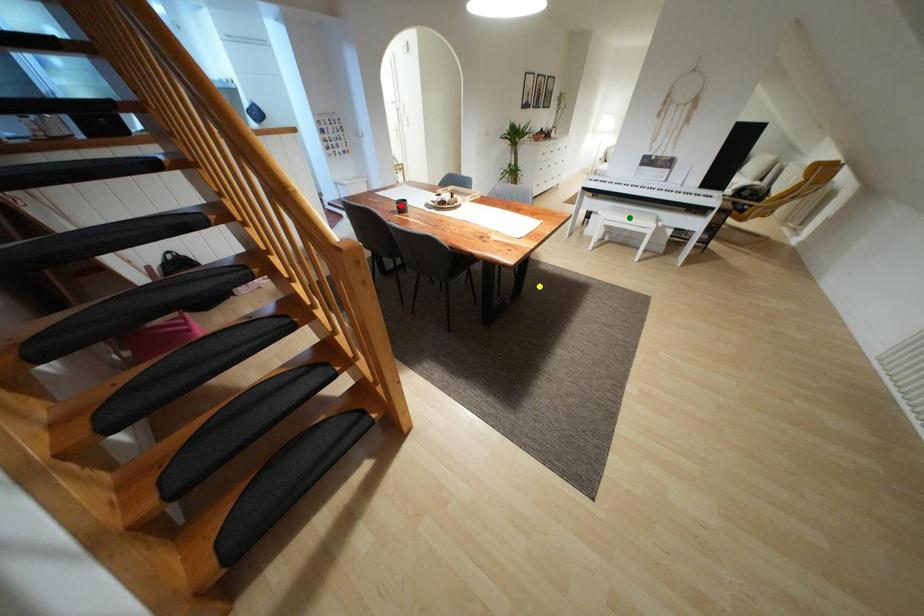
In the scene shown: Order these from farthest to nearest:
- yellow point
- red point
- green point

green point, yellow point, red point